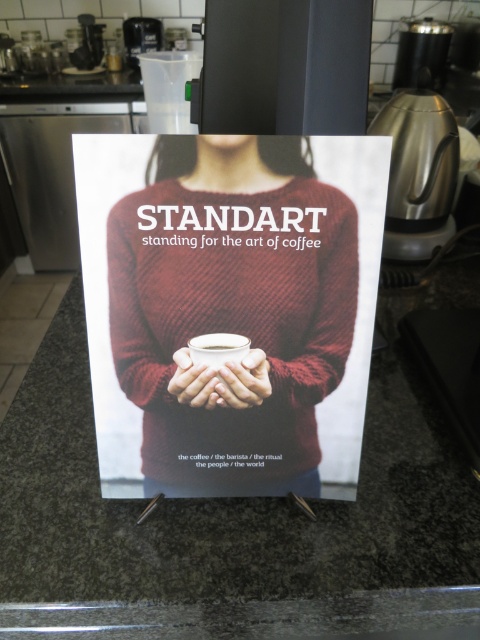
Question: Considering the relative positions of matte red sweater at center and matte brown hands at center in the image provided, where is matte red sweater at center located with respect to matte brown hands at center?

Choices:
 (A) above
 (B) below

Answer: (A)

Question: Considering the real-world distances, which object is farthest from the white matte cup at center?

Choices:
 (A) matte brown cup at center
 (B) matte red sweater at center
 (C) matte brown hands at center

Answer: (B)

Question: Is matte brown hands at center bigger than white matte cup at center?

Choices:
 (A) no
 (B) yes

Answer: (B)

Question: Does matte red sweater at center come in front of white matte cup at center?

Choices:
 (A) no
 (B) yes

Answer: (B)

Question: Which object appears farthest from the camera in this image?

Choices:
 (A) matte red sweater at center
 (B) white matte cup at center

Answer: (B)

Question: Which point is farther from the camera taking this photo?

Choices:
 (A) (220, 349)
 (B) (235, 396)
 (C) (197, 244)

Answer: (B)